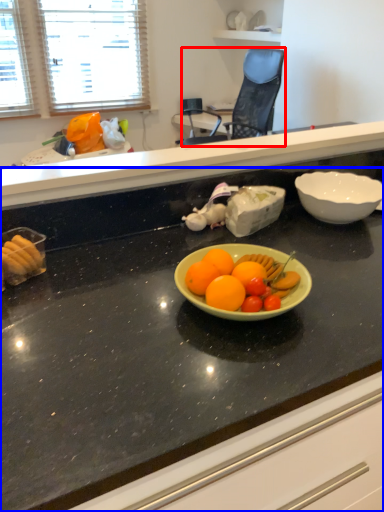
Question: Which point is closer to the camera, chair (highlighted by a red box) or countertop (highlighted by a blue box)?

Choices:
 (A) chair
 (B) countertop

Answer: (B)